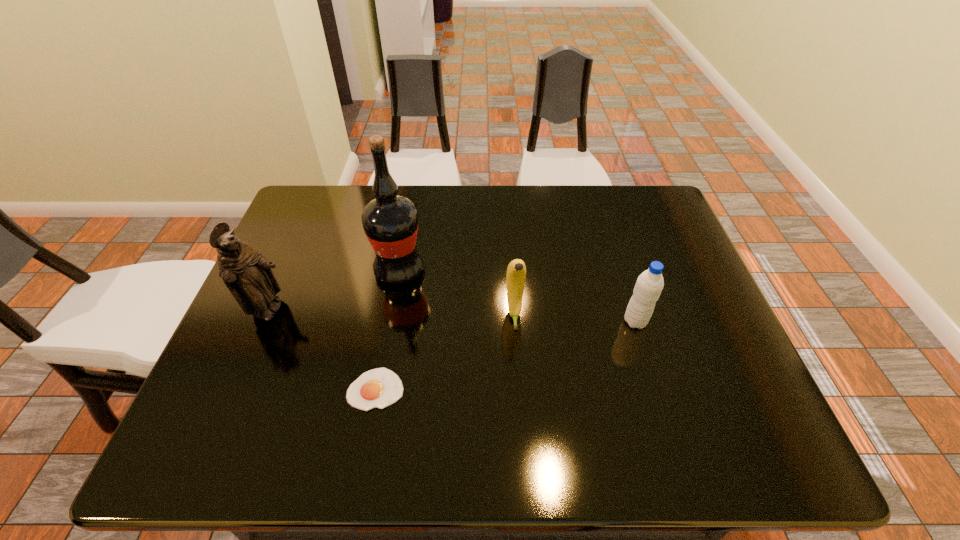
Where is `object that is the second closest one to the water bottle`? object that is the second closest one to the water bottle is located at coordinates (390, 222).

Identify the location of vacant space that satisfies the following two spatial constraints: 1. from the stem of the banana; 2. on the left side of the rightmost object. This screenshot has height=540, width=960. (515, 321).

At what (x,y) coordinates should I click in order to perform the action: click on vacant space that satisfies the following two spatial constraints: 1. on the front-facing side of the leftmost object; 2. on the right side of the nearest object. Please return your answer as a coordinate pair (x, y). This screenshot has height=540, width=960. Looking at the image, I should click on (236, 389).

This screenshot has width=960, height=540. Find the location of `free space that satisfies the following two spatial constraints: 1. on the front-facing side of the leftmost object; 2. on the back side of the nearest object`. free space that satisfies the following two spatial constraints: 1. on the front-facing side of the leftmost object; 2. on the back side of the nearest object is located at coordinates (236, 389).

The height and width of the screenshot is (540, 960). Identify the location of free space that satisfies the following two spatial constraints: 1. on the back side of the rightmost object; 2. on the front-facing side of the leftmost object. (633, 311).

At what (x,y) coordinates should I click in order to perform the action: click on free location that satisfies the following two spatial constraints: 1. on the front-facing side of the figurine; 2. on the right side of the water bottle. Please return your answer as a coordinate pair (x, y). This screenshot has width=960, height=540. Looking at the image, I should click on (266, 321).